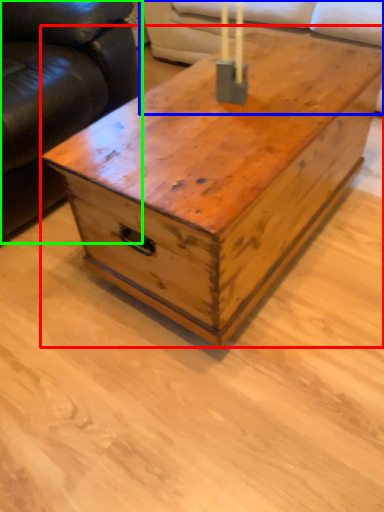
Question: Which object is the farthest from table (highlighted by a red box)? Choose among these: couch (highlighted by a blue box) or studio couch (highlighted by a green box).

Choices:
 (A) couch
 (B) studio couch

Answer: (A)